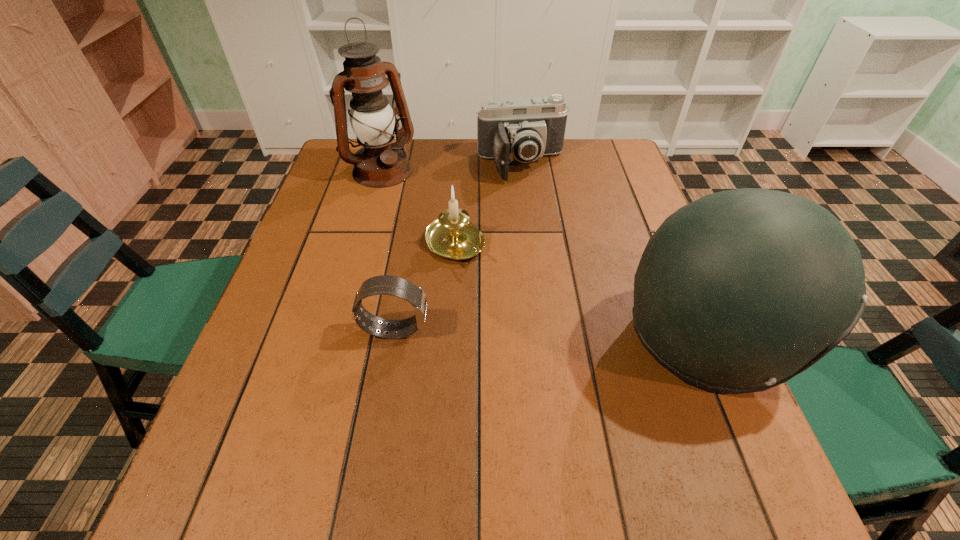
Where is `the shortest object`? The height and width of the screenshot is (540, 960). the shortest object is located at coordinates (396, 286).

You are a GUI agent. You are given a task and a screenshot of the screen. Output one action in this format:
    pyautogui.click(x=<x>, y=<y>)
    Task: Click on the fourth shortest object
    This screenshot has width=960, height=540.
    Given the screenshot: What is the action you would take?
    pyautogui.click(x=739, y=291)

Where is `the rightmost object`? The width and height of the screenshot is (960, 540). the rightmost object is located at coordinates point(739,291).

At what (x,y) coordinates should I click in order to perform the action: click on lantern. Please return your answer as a coordinate pair (x, y). The height and width of the screenshot is (540, 960). Looking at the image, I should click on (380, 163).

Where is `the third nearest object`? The height and width of the screenshot is (540, 960). the third nearest object is located at coordinates (453, 237).

Where is `camera`? camera is located at coordinates click(x=523, y=129).

Where is `free region located 0.370m on the face of the watch`? free region located 0.370m on the face of the watch is located at coordinates (609, 329).

Image resolution: width=960 pixels, height=540 pixels. Identify the location of free space located on the side of the lantern, there is a wick adjustment knob. (461, 252).

At what (x,y) coordinates should I click in order to perform the action: click on vacant space located on the side of the lantern, there is a wick adjustment knob. Please return your answer as a coordinate pair (x, y). The width and height of the screenshot is (960, 540). Looking at the image, I should click on (468, 259).

Identify the location of vacant space situated 0.130m on the side of the lantern, there is a wick adjustment knob. (419, 208).